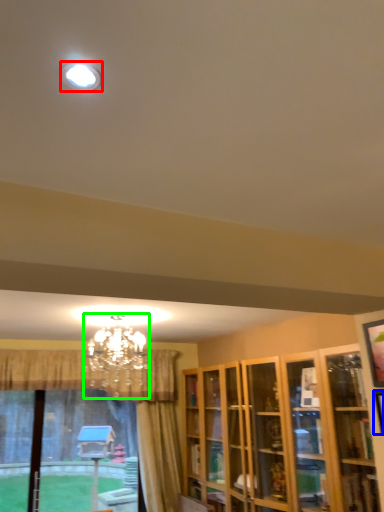
Question: Which is nearer to the lighting (highlighted by a red box)? picture frame (highlighted by a blue box) or lamp (highlighted by a green box).

Choices:
 (A) picture frame
 (B) lamp

Answer: (A)